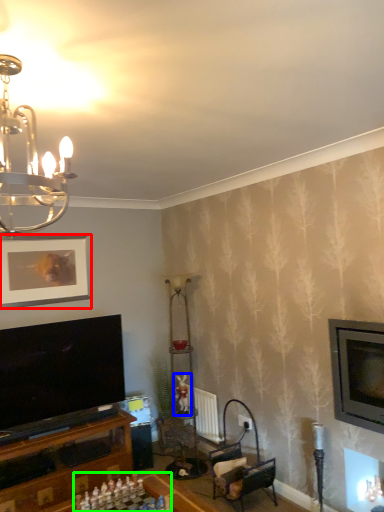
Question: Which object is positioned closest to picture frame (highlighted by a red box)? Select from toy (highlighted by a blue box) and board game (highlighted by a green box).

Choices:
 (A) toy
 (B) board game

Answer: (A)